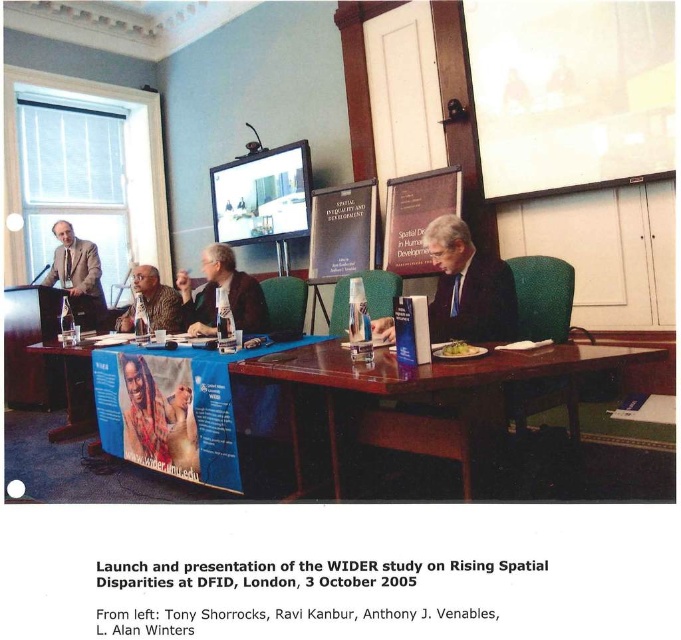
You are organizing a presentation and need to ensure that the matte black laptop at center is visible to the audience. Since both the matte paper banner at center and the laptop are at the center, which object should be moved to make the laptop visible?

The matte paper banner at center should be moved because the matte black laptop at center is behind it, so moving the banner would reveal the laptop.